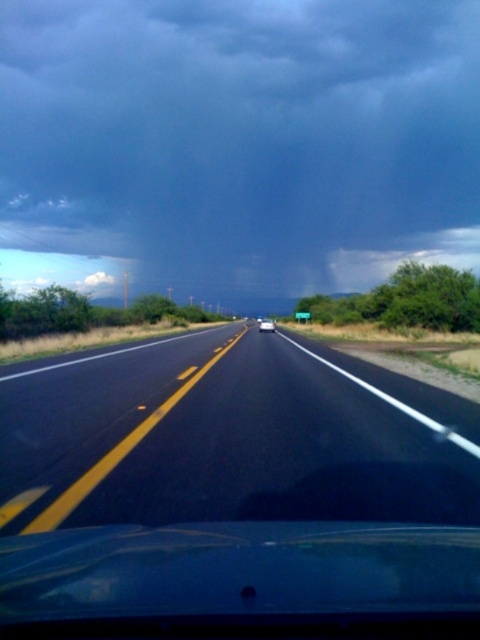
Question: Is dark gray cloud at upper center above black asphalt highway at center?

Choices:
 (A) yes
 (B) no

Answer: (A)

Question: Which object is farther from the camera taking this photo?

Choices:
 (A) white glossy sedan at center
 (B) dark gray cloud at upper center

Answer: (B)

Question: Is black asphalt highway at center bigger than white glossy sedan at center?

Choices:
 (A) yes
 (B) no

Answer: (B)

Question: Which of these objects is positioned closest to the black asphalt highway at center?

Choices:
 (A) white glossy sedan at center
 (B) dark gray cloud at upper center

Answer: (A)

Question: Can you confirm if dark gray cloud at upper center is positioned above white glossy sedan at center?

Choices:
 (A) no
 (B) yes

Answer: (B)

Question: Considering the real-world distances, which object is closest to the dark gray cloud at upper center?

Choices:
 (A) black asphalt highway at center
 (B) white glossy sedan at center

Answer: (B)